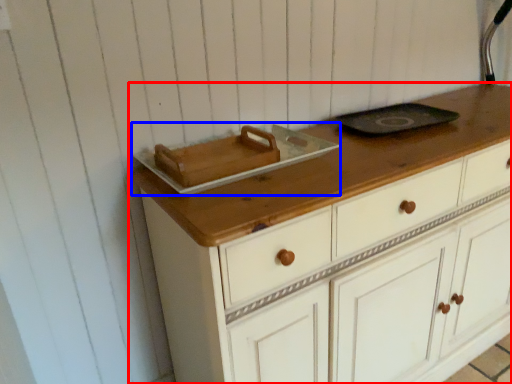
Question: Which object appears farthest to the camera in this image, chest of drawers (highlighted by a red box) or appliance (highlighted by a blue box)?

Choices:
 (A) chest of drawers
 (B) appliance

Answer: (B)